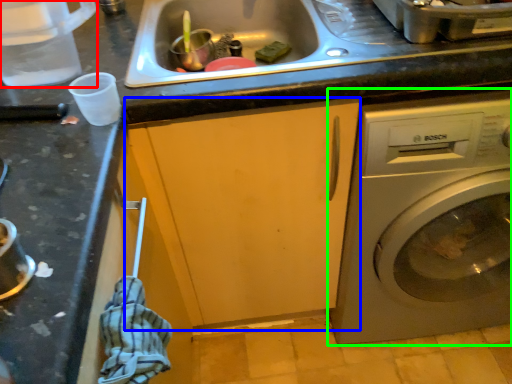
Question: Which object is positioned farthest from appliance (highlighted by a red box)? Select from cabinetry (highlighted by a blue box) and washing machine (highlighted by a green box).

Choices:
 (A) cabinetry
 (B) washing machine

Answer: (B)